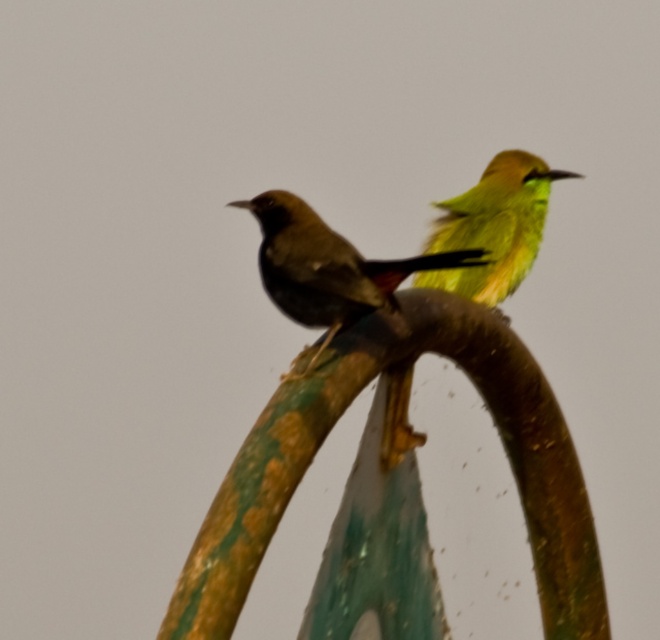
You are a birdwatcher trying to locate the shiny black bird at center in the image. What are the coordinates where you should look?

The shiny black bird at center is located at coordinates point (327, 268).

Looking at this image, you are a birdwatcher observing the scene. You notice the shiny black bird at center and the green matte parrot at upper right. Which bird is positioned to the left of the other?

The shiny black bird at center is to the left of the green matte parrot at upper right.

You are a photographer trying to capture a closeup of the bird at point (265, 193) and the bird at point (515, 177). Which bird will appear larger in your photo?

The bird at point (265, 193) will appear larger in the photo because it is closer to the camera than the bird at point (515, 177).